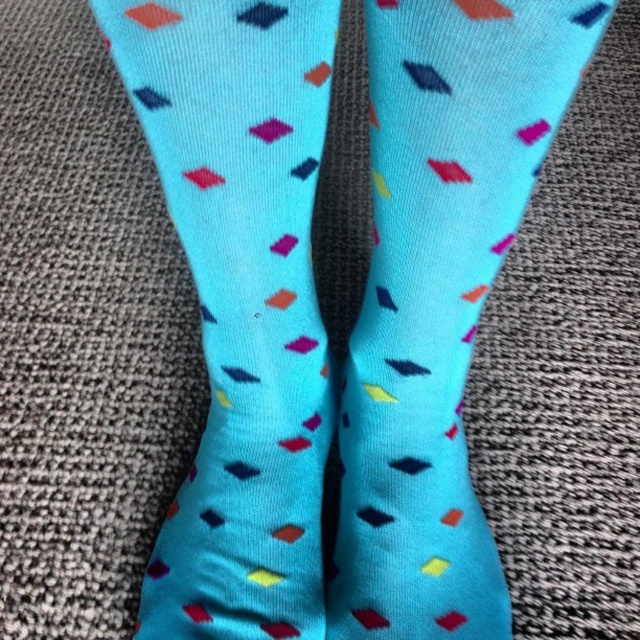
Who is higher up, matte blue socks at center or turquoise knitted socks at center?

turquoise knitted socks at center is higher up.

Is matte blue socks at center smaller than turquoise knitted socks at center?

Yes.

The image size is (640, 640). Describe the element at coordinates (438, 298) in the screenshot. I see `matte blue socks at center` at that location.

Where is `matte blue socks at center`? The height and width of the screenshot is (640, 640). matte blue socks at center is located at coordinates (438, 298).